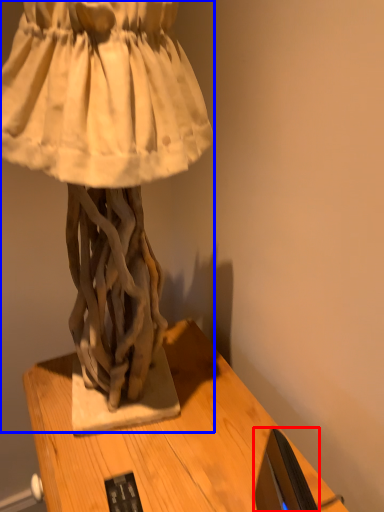
Question: Which object is further to the camera taking this photo, computer monitor (highlighted by a red box) or sculpture (highlighted by a blue box)?

Choices:
 (A) computer monitor
 (B) sculpture

Answer: (A)